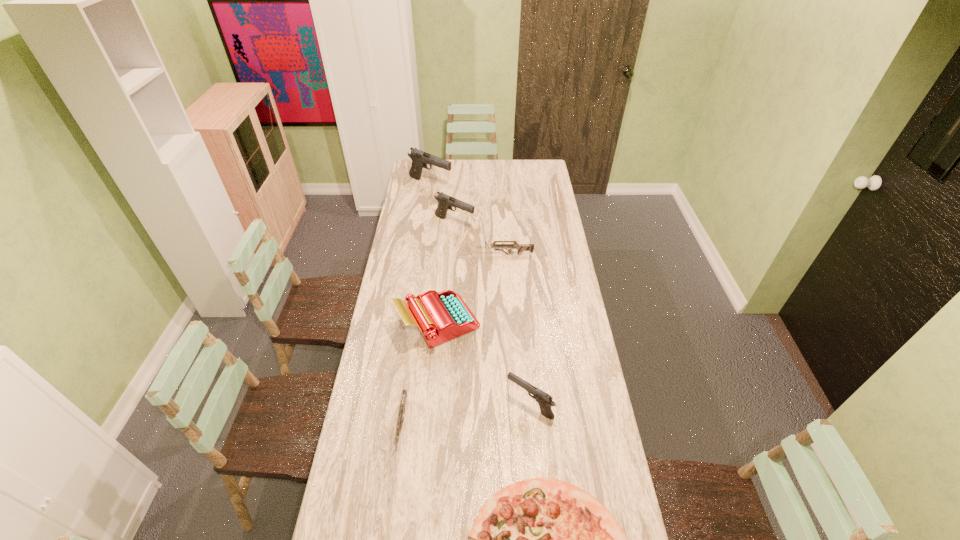
Find the location of a particular element. The height and width of the screenshot is (540, 960). the nearer grey gun is located at coordinates (404, 394).

Where is `free space located at the muzzle of the biggest black gun`? The width and height of the screenshot is (960, 540). free space located at the muzzle of the biggest black gun is located at coordinates (481, 184).

Locate an element on the screen. vacant space situated at the muzzle of the second farthest object is located at coordinates (518, 223).

This screenshot has height=540, width=960. I want to click on vacant space located on the typing side of the fourth nearest object, so click(x=536, y=322).

Locate an element on the screen. This screenshot has height=540, width=960. free spot located 0.330m at the muzzle of the third tallest gun is located at coordinates (414, 404).

Find the location of a particular element. blank space located 0.070m at the muzzle of the third tallest gun is located at coordinates (487, 404).

Find the location of `vacant area situated at the muzzle of the third tallest gun`. vacant area situated at the muzzle of the third tallest gun is located at coordinates (462, 404).

You are a GUI agent. You are given a task and a screenshot of the screen. Output one action in this format:
    pyautogui.click(x=<x>, y=<y>)
    Task: Click on the vacant space located aimed along the barrel of the fifth nearest object
    The height and width of the screenshot is (540, 960).
    Given the screenshot: What is the action you would take?
    pyautogui.click(x=461, y=254)

Where is `free space located 0.110m aimed along the barrel of the fifth nearest object`? Image resolution: width=960 pixels, height=540 pixels. free space located 0.110m aimed along the barrel of the fifth nearest object is located at coordinates (455, 254).

This screenshot has width=960, height=540. What are the coordinates of `free location located aimed along the barrel of the fifth nearest object` in the screenshot? It's located at (461, 254).